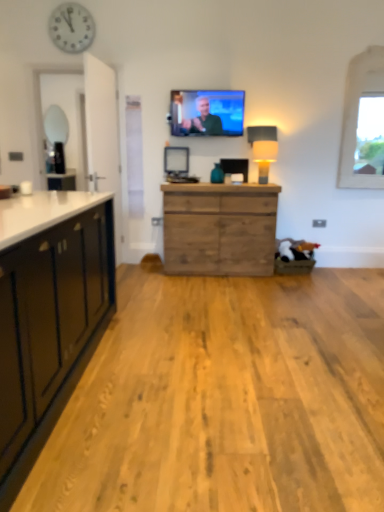
Find the location of `white stone window at upper right`. white stone window at upper right is located at coordinates (363, 123).

This screenshot has width=384, height=512. What do you see at coordinates (363, 123) in the screenshot? I see `white stone window at upper right` at bounding box center [363, 123].

Identify the location of matte black television at upper center. The image size is (384, 512). (207, 112).

Describe the element at coordinates (219, 228) in the screenshot. I see `wooden chest of drawers at center` at that location.

Image resolution: width=384 pixels, height=512 pixels. I want to click on wooden chest of drawers at center, so point(219,228).

Find the location of a particular element. This screenshot has height=512, width=384. white stone window at upper right is located at coordinates (363, 123).

How different are the orientations of matte black television at upper center and white fabric lampshade at right in degrees?

The angle between the facing direction of matte black television at upper center and the facing direction of white fabric lampshade at right is 3.05 degrees.

Considering the sizes of objects matte black television at upper center and white fabric lampshade at right in the image provided, who is bigger, matte black television at upper center or white fabric lampshade at right?

With larger size is matte black television at upper center.

How far apart are matte black television at upper center and white fabric lampshade at right?

They are 17.45 inches apart.

You are a GUI agent. You are given a task and a screenshot of the screen. Output one action in this format:
    pyautogui.click(x=<x>, y=<y>)
    Task: Click on the lamp in front of the matte black television at upper center
    This screenshot has height=512, width=384.
    Given the screenshot: What is the action you would take?
    pyautogui.click(x=263, y=148)

Can you tell me how much white fabric lampshade at right and white plastic clock at upper left differ in facing direction?

white fabric lampshade at right and white plastic clock at upper left are facing 0.408 degrees away from each other.

Can you confirm if white fabric lampshade at right is smaller than white plastic clock at upper left?

Incorrect, white fabric lampshade at right is not smaller in size than white plastic clock at upper left.

In the image, is white fabric lampshade at right positioned in front of or behind white plastic clock at upper left?

white fabric lampshade at right is positioned closer to the viewer than white plastic clock at upper left.

Is white fabric lampshade at right touching white plastic clock at upper left?

No, white fabric lampshade at right is not next to white plastic clock at upper left.

Which of these two, white stone window at upper right or white fabric lampshade at right, is wider?

white fabric lampshade at right.

Consider the image. Does white stone window at upper right have a greater height compared to white fabric lampshade at right?

Indeed, white stone window at upper right has a greater height compared to white fabric lampshade at right.

The height and width of the screenshot is (512, 384). I want to click on lamp that is in front of the white stone window at upper right, so click(x=263, y=148).

Is the surface of white stone window at upper right in direct contact with matte black television at upper center?

They are not placed beside each other.

Considering the positions of points (353, 105) and (234, 114), is point (353, 105) farther from camera compared to point (234, 114)?

Yes, point (353, 105) is behind point (234, 114).

Is white stone window at upper right taller or shorter than matte black television at upper center?

Clearly, white stone window at upper right is taller compared to matte black television at upper center.

Do you think white fabric lampshade at right is within white stone window at upper right, or outside of it?

The correct answer is: outside.

Is the position of white fabric lampshade at right more distant than that of white stone window at upper right?

No, white fabric lampshade at right is closer to the viewer.

Is white fabric lampshade at right facing towards white stone window at upper right?

No, white fabric lampshade at right is not oriented towards white stone window at upper right.

Measure the distance from white fabric lampshade at right to white stone window at upper right.

white fabric lampshade at right is 93.82 centimeters away from white stone window at upper right.

Is wooden chest of drawers at center completely or partially outside of white fabric lampshade at right?

wooden chest of drawers at center lies outside white fabric lampshade at right's area.

Is wooden chest of drawers at center aimed at white fabric lampshade at right?

No, wooden chest of drawers at center is not turned towards white fabric lampshade at right.

Does wooden chest of drawers at center come behind white fabric lampshade at right?

No, it is in front of white fabric lampshade at right.

Can you confirm if wooden chest of drawers at center is wider than white fabric lampshade at right?

Indeed, wooden chest of drawers at center has a greater width compared to white fabric lampshade at right.

You are a GUI agent. You are given a task and a screenshot of the screen. Output one action in this format:
    pyautogui.click(x=<x>, y=<y>)
    Task: Click on the window below the matte black television at upper center (from a real-world perspective)
    The width and height of the screenshot is (384, 512).
    Given the screenshot: What is the action you would take?
    pyautogui.click(x=363, y=123)

Considering the sizes of objects matte black television at upper center and white stone window at upper right in the image provided, who is shorter, matte black television at upper center or white stone window at upper right?

matte black television at upper center is shorter.

Between point (204, 117) and point (383, 63), which one is positioned in front?

The point (383, 63) is in front.

Would you say matte black television at upper center contains white stone window at upper right?

No.

Identify the location of lamp located on the right of matte black television at upper center. (263, 148).

The height and width of the screenshot is (512, 384). Identify the location of clock that is behind the white fabric lampshade at right. (71, 27).

Considering their positions, is white stone window at upper right positioned closer to white fabric lampshade at right than wooden chest of drawers at center?

wooden chest of drawers at center lies closer to white fabric lampshade at right than the other object.

From the image, which object appears to be nearer to wooden chest of drawers at center, white fabric lampshade at right or white stone window at upper right?

white fabric lampshade at right is positioned closer to the anchor wooden chest of drawers at center.

Based on their spatial positions, is white plastic clock at upper left or white fabric lampshade at right closer to matte black television at upper center?

white fabric lampshade at right is closer to matte black television at upper center.

When comparing their distances from matte black television at upper center, does white stone window at upper right or white fabric lampshade at right seem further?

white stone window at upper right is positioned further to the anchor matte black television at upper center.

Estimate the real-world distances between objects in this image. Which object is closer to wooden chest of drawers at center, white fabric lampshade at right or white plastic clock at upper left?

white fabric lampshade at right is closer to wooden chest of drawers at center.

Which object lies nearer to the anchor point wooden chest of drawers at center, matte black television at upper center or white fabric lampshade at right?

white fabric lampshade at right lies closer to wooden chest of drawers at center than the other object.

Considering their positions, is white fabric lampshade at right positioned closer to white plastic clock at upper left than matte black television at upper center?

Among the two, matte black television at upper center is located nearer to white plastic clock at upper left.

Based on their spatial positions, is white plastic clock at upper left or wooden chest of drawers at center closer to white stone window at upper right?

wooden chest of drawers at center is positioned closer to the anchor white stone window at upper right.

What are the coordinates of `lamp located between wooden chest of drawers at center and white stone window at upper right in the left-right direction` in the screenshot? It's located at (263, 148).

I want to click on the chest of drawers situated between matte black television at upper center and white stone window at upper right from left to right, so click(x=219, y=228).

Identify the location of television between white plastic clock at upper left and white stone window at upper right from left to right. (207, 112).

Identify the location of chest of drawers between white plastic clock at upper left and white fabric lampshade at right. The image size is (384, 512). (219, 228).